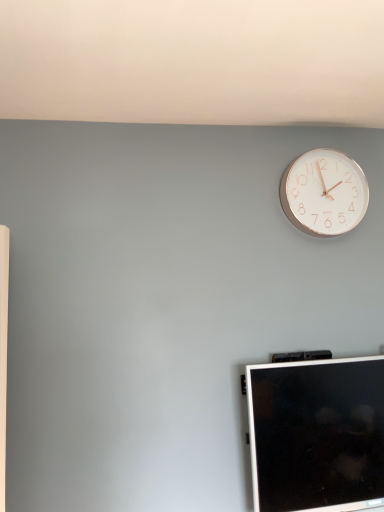
Question: Considering the relative positions of black glossy monitor at lower right and white metallic clock at upper right in the image provided, is black glossy monitor at lower right to the left of white metallic clock at upper right from the viewer's perspective?

Choices:
 (A) yes
 (B) no

Answer: (A)

Question: Does black glossy monitor at lower right lie behind white metallic clock at upper right?

Choices:
 (A) yes
 (B) no

Answer: (B)

Question: Does black glossy monitor at lower right turn towards white metallic clock at upper right?

Choices:
 (A) no
 (B) yes

Answer: (A)

Question: Does black glossy monitor at lower right have a greater width compared to white metallic clock at upper right?

Choices:
 (A) no
 (B) yes

Answer: (B)

Question: Is the surface of black glossy monitor at lower right in direct contact with white metallic clock at upper right?

Choices:
 (A) no
 (B) yes

Answer: (A)

Question: Does black glossy monitor at lower right lie in front of white metallic clock at upper right?

Choices:
 (A) yes
 (B) no

Answer: (A)

Question: Is white metallic clock at upper right aimed at black glossy monitor at lower right?

Choices:
 (A) no
 (B) yes

Answer: (A)

Question: Is white metallic clock at upper right outside black glossy monitor at lower right?

Choices:
 (A) no
 (B) yes

Answer: (B)

Question: Does white metallic clock at upper right have a smaller size compared to black glossy monitor at lower right?

Choices:
 (A) yes
 (B) no

Answer: (A)

Question: Can you confirm if white metallic clock at upper right is wider than black glossy monitor at lower right?

Choices:
 (A) yes
 (B) no

Answer: (B)

Question: From the image's perspective, is white metallic clock at upper right located beneath black glossy monitor at lower right?

Choices:
 (A) yes
 (B) no

Answer: (B)

Question: Considering the relative positions of white metallic clock at upper right and black glossy monitor at lower right in the image provided, is white metallic clock at upper right behind black glossy monitor at lower right?

Choices:
 (A) yes
 (B) no

Answer: (A)

Question: Does point (309, 172) appear closer or farther from the camera than point (377, 416)?

Choices:
 (A) farther
 (B) closer

Answer: (A)